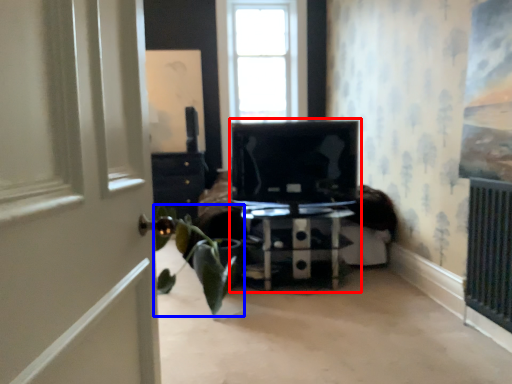
Question: Which object appears farthest to the camera in this image, entertainment center (highlighted by a red box) or houseplant (highlighted by a blue box)?

Choices:
 (A) entertainment center
 (B) houseplant

Answer: (A)